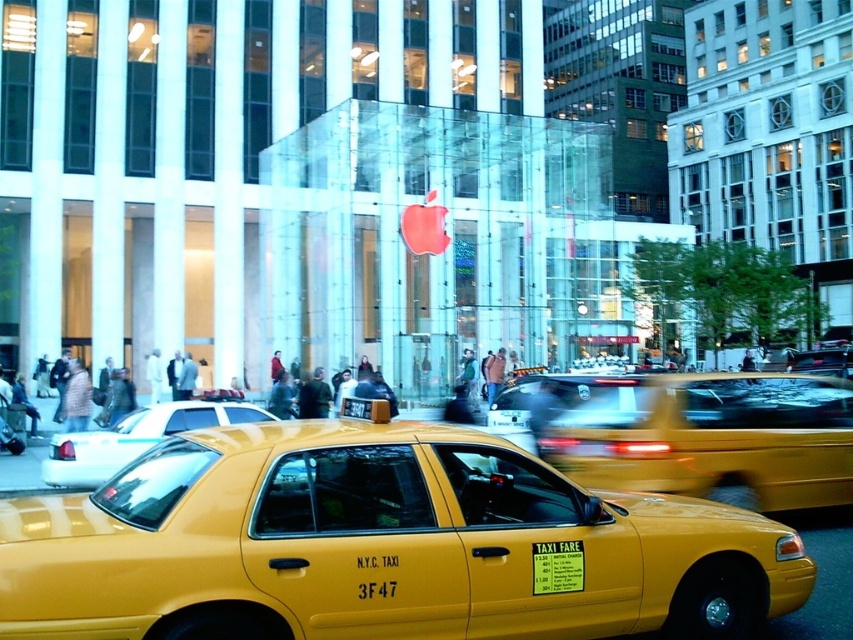
Question: Does yellow matte taxi at center have a larger size compared to yellow plastic taxi cab at center?

Choices:
 (A) no
 (B) yes

Answer: (B)

Question: Which point is closer to the camera taking this photo?

Choices:
 (A) (598, 433)
 (B) (94, 477)
 (C) (289, 600)

Answer: (C)

Question: Which point appears farthest from the camera in this image?

Choices:
 (A) (39, 470)
 (B) (599, 436)

Answer: (A)

Question: Considering the relative positions of matte yellow taxi at center and yellow matte taxi at center in the image provided, where is matte yellow taxi at center located with respect to yellow matte taxi at center?

Choices:
 (A) right
 (B) left

Answer: (B)

Question: Which point is farther from the camera taking this photo?

Choices:
 (A) click(x=71, y=445)
 (B) click(x=721, y=493)

Answer: (A)

Question: Can you confirm if matte yellow taxi at center is thinner than yellow plastic taxi cab at center?

Choices:
 (A) yes
 (B) no

Answer: (B)